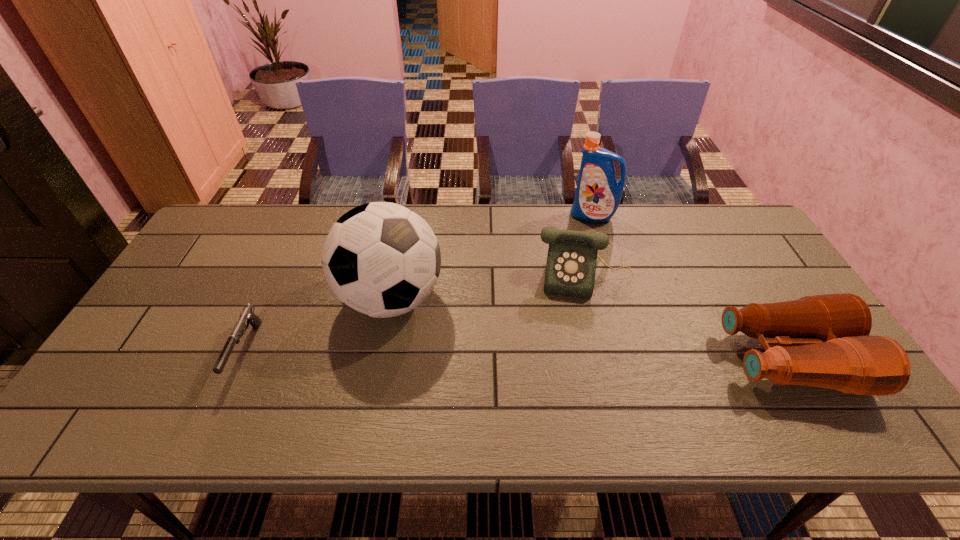
Identify the location of free space located on the main logo of the soccer ball. Image resolution: width=960 pixels, height=540 pixels. (564, 389).

Locate an element on the screen. vacant region located on the main logo of the soccer ball is located at coordinates (502, 356).

Identify the location of vacant space located on the dial of the telephone. click(x=582, y=325).

Locate an element on the screen. Image resolution: width=960 pixels, height=540 pixels. free space located 0.050m on the dial of the telephone is located at coordinates (583, 313).

Where is `vacant space located on the dial of the telephone`? This screenshot has width=960, height=540. vacant space located on the dial of the telephone is located at coordinates (582, 346).

Where is `object present at the far edge`? object present at the far edge is located at coordinates (598, 194).

The image size is (960, 540). Identify the location of gun positioned at the near edge. (247, 315).

Find the location of a particular element. The width and height of the screenshot is (960, 540). binoculars at the near edge is located at coordinates (837, 352).

You are a GUI agent. You are given a task and a screenshot of the screen. Output one action in this format:
    pyautogui.click(x=<x>, y=<y>)
    Task: Click on the object that is at the right edge
    The height and width of the screenshot is (540, 960).
    Given the screenshot: What is the action you would take?
    pyautogui.click(x=837, y=352)

You are a GUI agent. You are given a task and a screenshot of the screen. Output one action in this format:
    pyautogui.click(x=<x>, y=<y>)
    Task: Click on the object positioned at the near right corner
    
    Given the screenshot: What is the action you would take?
    (x=837, y=352)